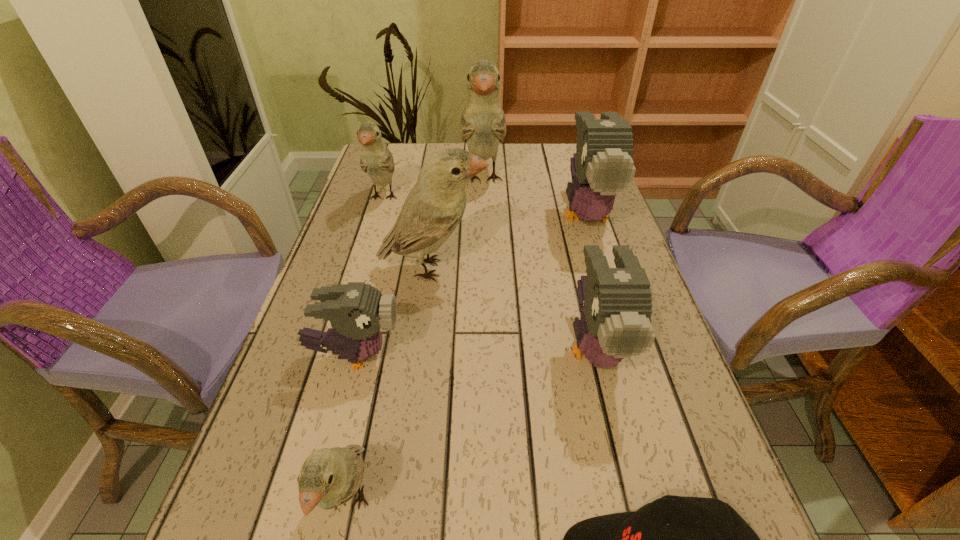
Locate an element on the screen. The image size is (960, 540). free location located at the beak of the farthest gray bird is located at coordinates (638, 382).

The image size is (960, 540). Find the location of `blank space located at the face of the third biggest white bird`. blank space located at the face of the third biggest white bird is located at coordinates (355, 290).

Identify the location of free space located 0.060m at the beak of the second biggest gray bird. (615, 434).

At what (x,y) coordinates should I click in order to perform the action: click on vacant area situated 0.160m at the beak of the smallest gray bird. Please return your answer as a coordinate pair (x, y). The height and width of the screenshot is (540, 960). Looking at the image, I should click on click(x=485, y=356).

Where is `object that is at the far edge`? object that is at the far edge is located at coordinates (483, 125).

In the image, there is a desktop. What are the coordinates of `vacant space at the far edge` in the screenshot? It's located at (540, 147).

Image resolution: width=960 pixels, height=540 pixels. In the image, there is a desktop. Find the location of `vacant space at the left edge`. vacant space at the left edge is located at coordinates 376,225.

I want to click on vacant space at the far right corner, so click(573, 146).

Image resolution: width=960 pixels, height=540 pixels. Find the location of `vacant space in between the second biggest gray bird and the second nearest white bird`. vacant space in between the second biggest gray bird and the second nearest white bird is located at coordinates (514, 308).

The height and width of the screenshot is (540, 960). Find the location of `vacant area that lies between the leftmost gray bird and the second biggest gray bird`. vacant area that lies between the leftmost gray bird and the second biggest gray bird is located at coordinates (475, 352).